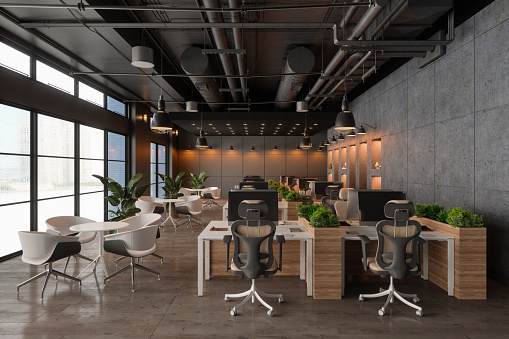
The width and height of the screenshot is (509, 339). I want to click on pipes on ceiling, so click(242, 105), click(260, 77), click(218, 41), click(238, 38), click(247, 24), click(256, 10), click(362, 29), click(350, 15), click(375, 33), click(357, 56).